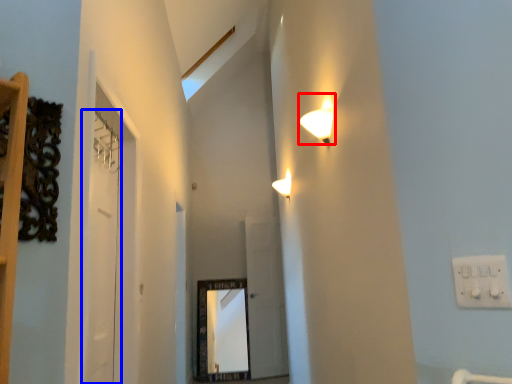
Question: Which object appears closest to the camera in this image, lamp (highlighted by a red box) or door (highlighted by a blue box)?

Choices:
 (A) lamp
 (B) door

Answer: (B)